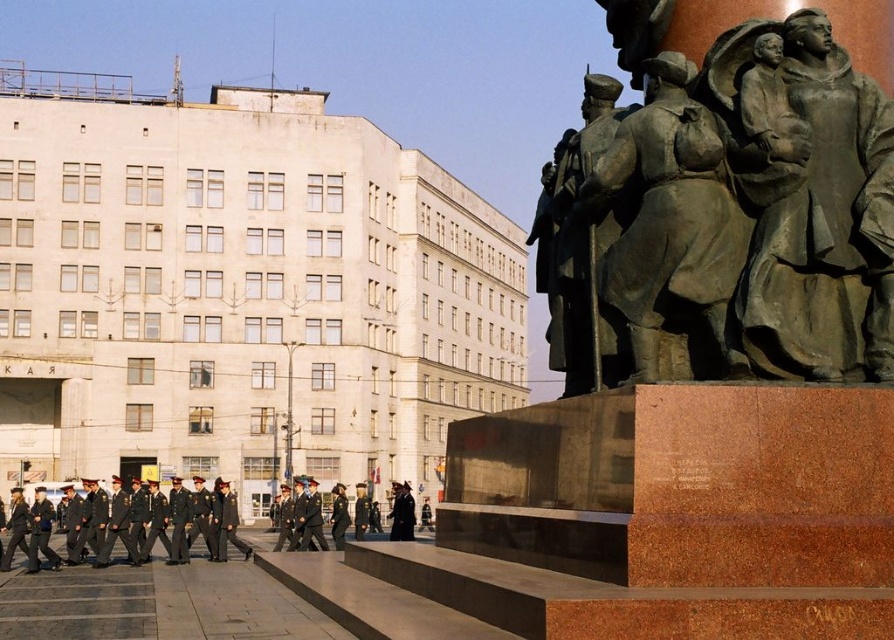
You are a photographer standing at the center of the parade ground. You want to take a picture of the bronze sculpture at right. According to the scene description, where should you position your camera to capture the sculpture in the frame?

The bronze sculpture at right is located at point (726,198). To capture it in the frame, position your camera at the center of the parade ground facing towards the right side of the image where the sculpture is situated.